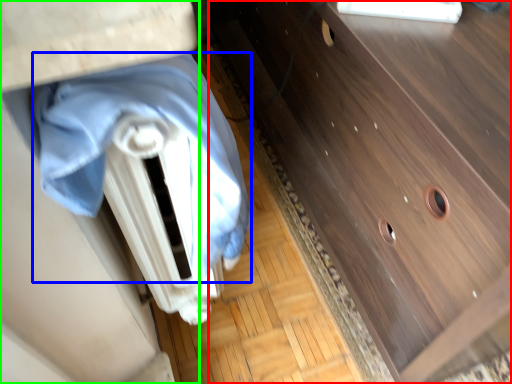
Question: Based on their relative distances, which object is nearer to chest of drawers (highlighted by a red box)? Choose from blanket (highlighted by a blue box) and vanity (highlighted by a green box).

Choices:
 (A) blanket
 (B) vanity

Answer: (A)